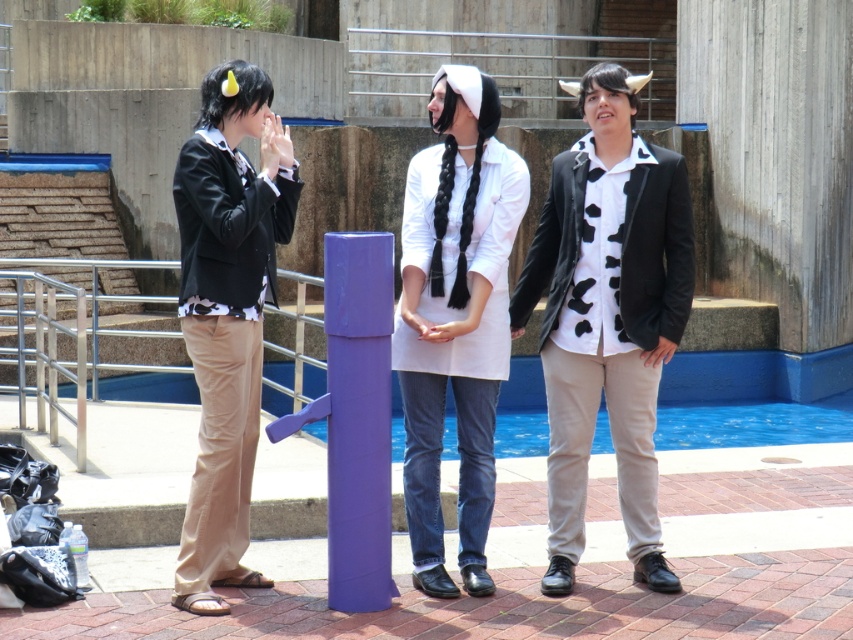
Question: Is the position of white matte shirt at center less distant than that of matte black jacket at left?

Choices:
 (A) yes
 (B) no

Answer: (B)

Question: Which object appears farthest from the camera in this image?

Choices:
 (A) matte black jacket at left
 (B) white matte shirt at center

Answer: (B)

Question: From the image, what is the correct spatial relationship of white matte shirt at center in relation to matte black jacket at left?

Choices:
 (A) left
 (B) right

Answer: (B)

Question: Does white matte shirt at center have a lesser width compared to white matte dress at center?

Choices:
 (A) no
 (B) yes

Answer: (A)

Question: Which point is farther to the camera?

Choices:
 (A) (224, 577)
 (B) (358, 611)
 (C) (408, 339)

Answer: (A)

Question: Among these points, which one is nearest to the camera?

Choices:
 (A) (457, 99)
 (B) (351, 556)
 (C) (590, 385)

Answer: (B)